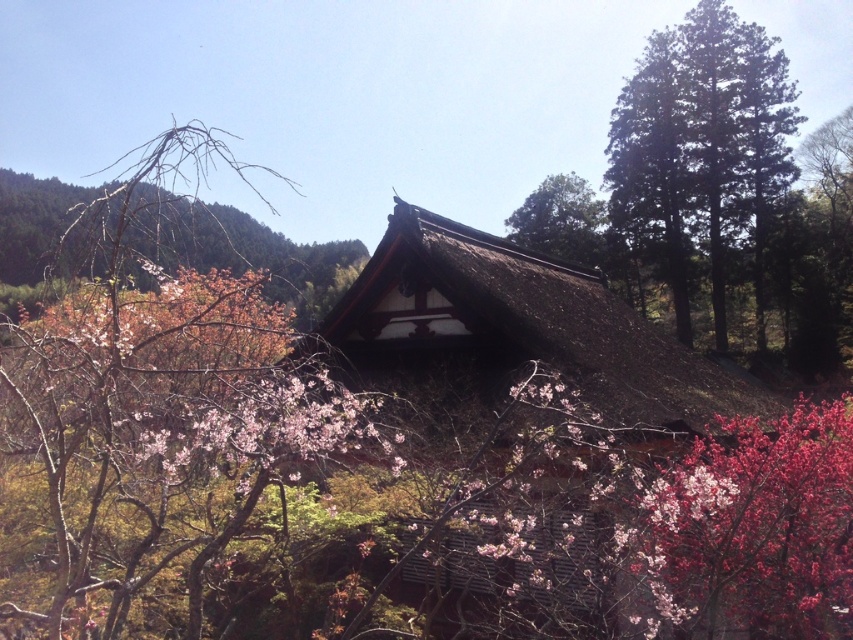
Is point (682, 28) more distant than point (577, 198)?

No.

Is green textured pine trees at upper right to the right of green leafy tree at upper center from the viewer's perspective?

Correct, you'll find green textured pine trees at upper right to the right of green leafy tree at upper center.

Describe the element at coordinates (701, 150) in the screenshot. Image resolution: width=853 pixels, height=640 pixels. I see `green textured pine trees at upper right` at that location.

Image resolution: width=853 pixels, height=640 pixels. Identify the location of green textured pine trees at upper right. (701, 150).

Can you confirm if brown thatched roof at center is positioned below green textured pine trees at upper right?

Indeed, brown thatched roof at center is positioned under green textured pine trees at upper right.

Where is `brown thatched roof at center`? The width and height of the screenshot is (853, 640). brown thatched roof at center is located at coordinates (514, 336).

The height and width of the screenshot is (640, 853). Identify the location of brown thatched roof at center. (514, 336).

Does pink matte flower at center appear over green leafy tree at upper center?

Actually, pink matte flower at center is below green leafy tree at upper center.

Which is in front, point (280, 468) or point (553, 211)?

Positioned in front is point (280, 468).

At what (x,y) coordinates should I click in order to perform the action: click on pink matte flower at center. Please return your answer as a coordinate pair (x, y). Looking at the image, I should click on (271, 429).